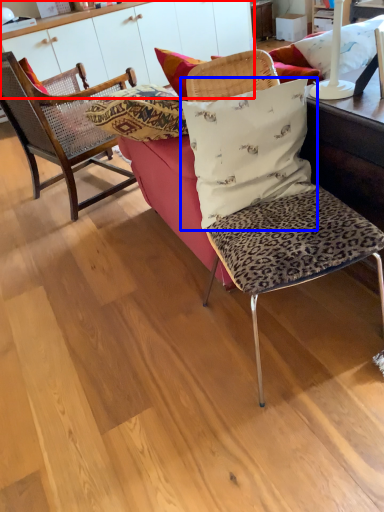
Question: Among these objects, which one is farthest to the camera, dresser (highlighted by a red box) or pillow (highlighted by a blue box)?

Choices:
 (A) dresser
 (B) pillow

Answer: (A)